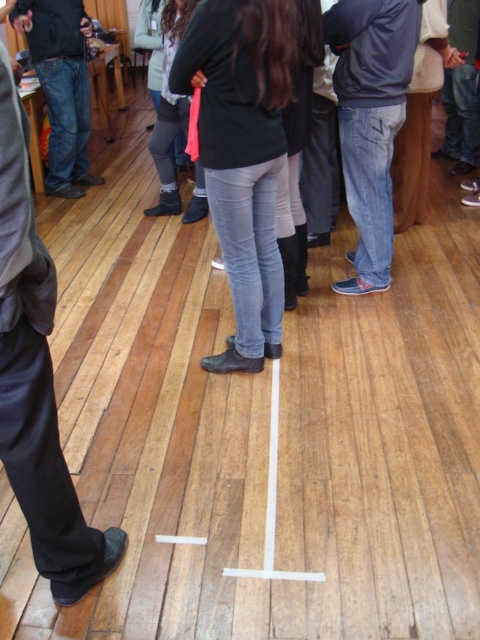
Question: Observing the image, what is the correct spatial positioning of jeans at center in reference to denim jeans at left?

Choices:
 (A) below
 (B) above

Answer: (A)

Question: Is the position of black leather pants at left more distant than that of denim jeans at left?

Choices:
 (A) no
 (B) yes

Answer: (A)

Question: Where is jeans at center located in relation to denim jeans at left in the image?

Choices:
 (A) left
 (B) right

Answer: (B)

Question: Which of the following is the farthest from the observer?

Choices:
 (A) denim jeans at left
 (B) jeans at center

Answer: (A)

Question: Which point appears farthest from the camera in this image?

Choices:
 (A) (359, 275)
 (B) (41, 566)

Answer: (A)

Question: Which of the following is the farthest from the observer?

Choices:
 (A) (363, 188)
 (B) (62, 90)
 (C) (88, 564)

Answer: (B)